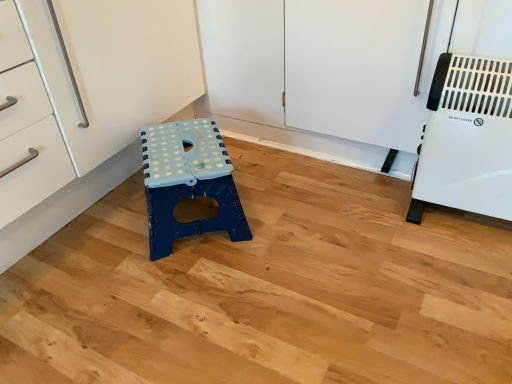
What are the coordinates of `free space in front of blue plastic stool at center` in the screenshot? It's located at 180,301.